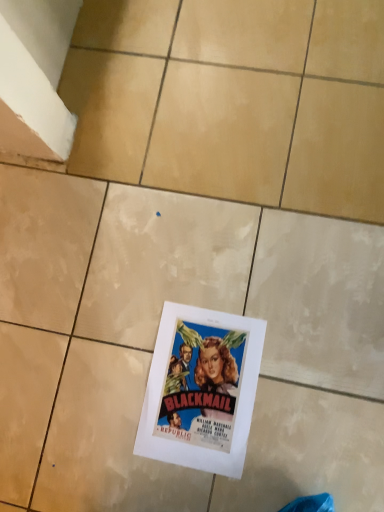
This screenshot has width=384, height=512. Identify the location of vacant space underneath matte paper poster at center (from a real-world perspective). (206, 388).